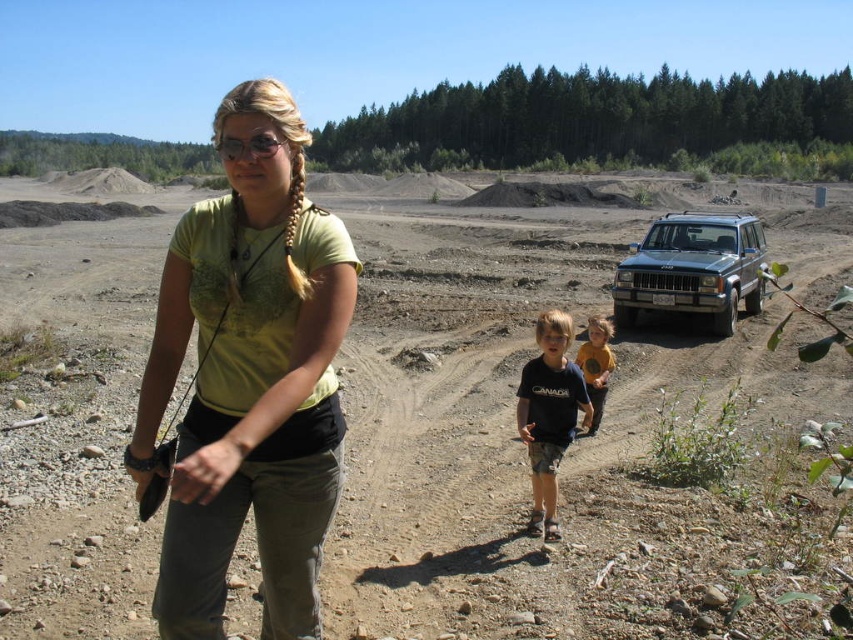
You are a photographer trying to capture the scene of the matte yellow shirt at center and the yellow cotton shirt at center. Which one is positioned to the left?

The matte yellow shirt at center is positioned to the left of the yellow cotton shirt at center.